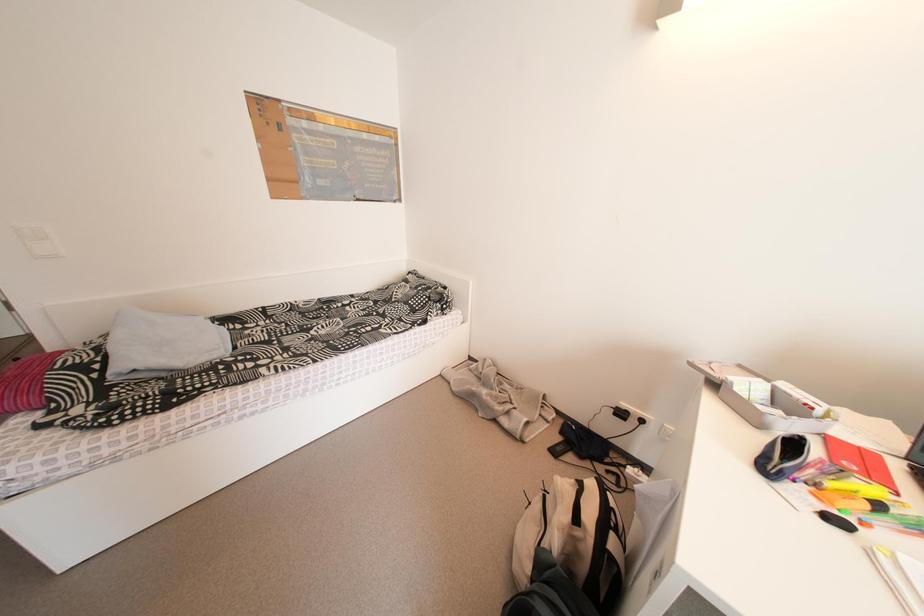
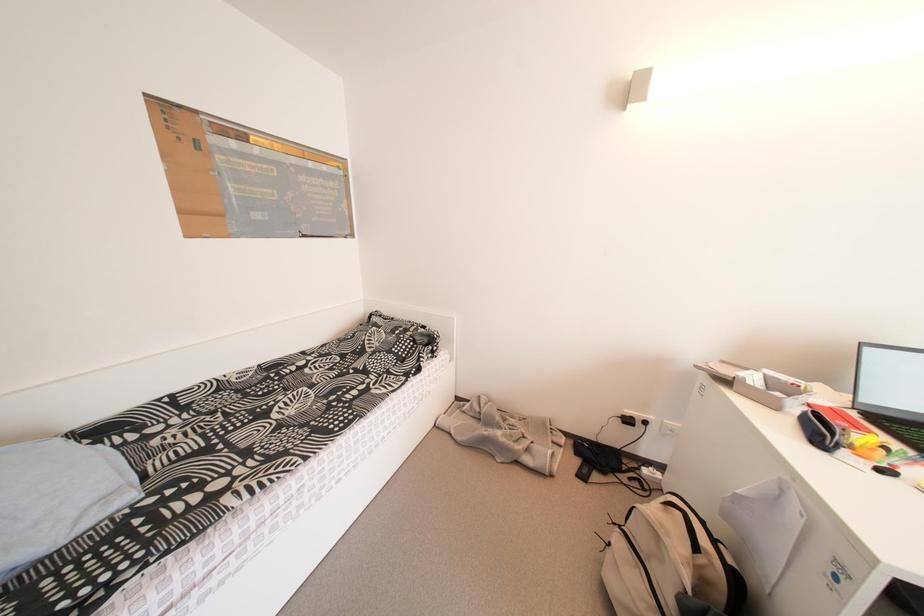
Question: The camera is either moving clockwise (left) or counter-clockwise (right) around the object. The first image is from the beginning of the video and the second image is from the end. Is the camera moving left or right when shooting the video?

Choices:
 (A) Left
 (B) Right

Answer: (A)